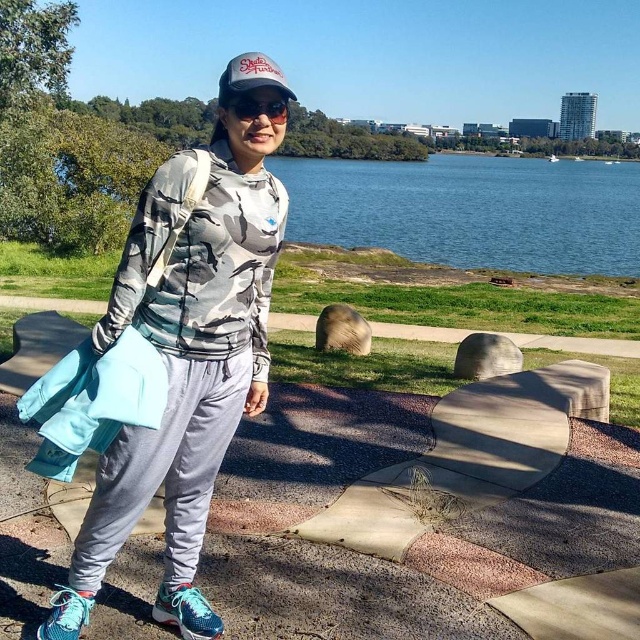
Question: Which object appears farthest from the camera in this image?

Choices:
 (A) black plastic goggles at center
 (B) camo fabric hoodie at center
 (C) blue water at center

Answer: (C)

Question: Which point appears closest to the camera in this image?

Choices:
 (A) (225, 102)
 (B) (500, 192)
 (C) (221, 435)

Answer: (A)

Question: Does blue water at center have a smaller size compared to black plastic goggles at center?

Choices:
 (A) no
 (B) yes

Answer: (A)

Question: Is camo fabric hoodie at center further to camera compared to black plastic goggles at center?

Choices:
 (A) no
 (B) yes

Answer: (A)

Question: Can you confirm if camo fabric hoodie at center is smaller than black plastic goggles at center?

Choices:
 (A) no
 (B) yes

Answer: (A)

Question: Which object is positioned closest to the camo fabric hoodie at center?

Choices:
 (A) black plastic goggles at center
 (B) blue water at center

Answer: (A)